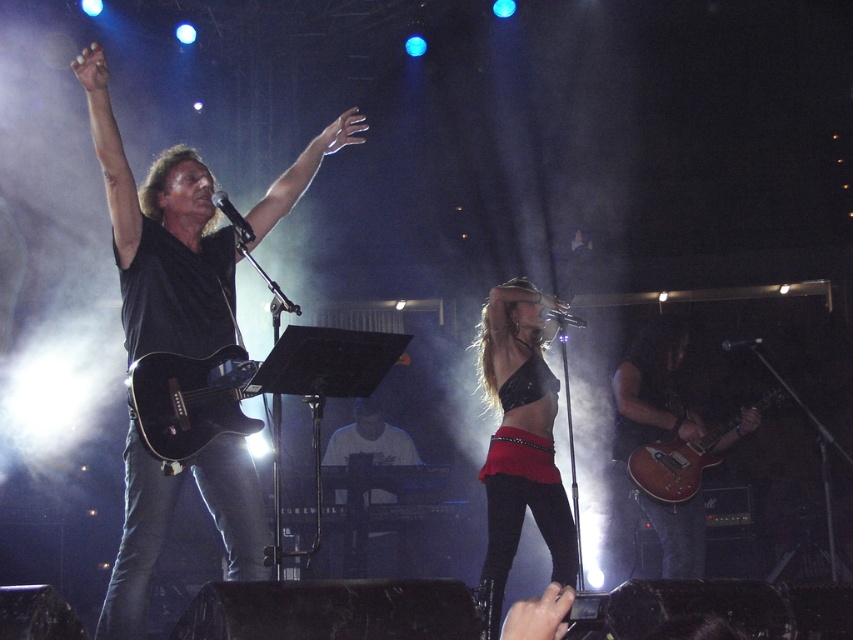
Question: Does shiny brown guitar at right appear on the left side of white matte keyboard at center?

Choices:
 (A) yes
 (B) no

Answer: (B)

Question: Among these objects, which one is farthest from the camera?

Choices:
 (A) glossy black guitar at center
 (B) shiny brown guitar at right
 (C) black leather bra at center
 (D) white matte keyboard at center

Answer: (D)

Question: Which object is farther from the camera taking this photo?

Choices:
 (A) black leather bra at center
 (B) black matte guitar at upper left
 (C) glossy wood electric guitar at lower right
 (D) shiny brown guitar at right

Answer: (C)

Question: Is black matte guitar at upper left bigger than glossy wood electric guitar at lower right?

Choices:
 (A) no
 (B) yes

Answer: (B)

Question: In this image, where is black matte guitar at upper left located relative to white matte keyboard at center?

Choices:
 (A) below
 (B) above

Answer: (B)

Question: Which object is positioned farthest from the black matte guitar at upper left?

Choices:
 (A) glossy wood electric guitar at lower right
 (B) white matte keyboard at center
 (C) glossy black guitar at center
 (D) shiny brown guitar at right

Answer: (B)